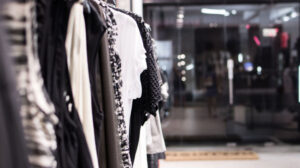
Find the location of `reflection of lights`. reflection of lights is located at coordinates (182, 57), (287, 16), (216, 11).